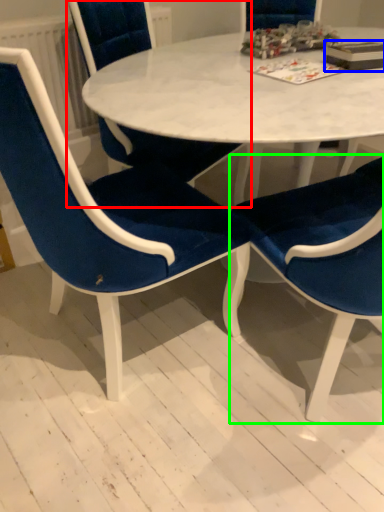
Question: Considering the real-world distances, which object is closest to chair (highlighted by a red box)? book (highlighted by a blue box) or chair (highlighted by a green box).

Choices:
 (A) book
 (B) chair

Answer: (B)